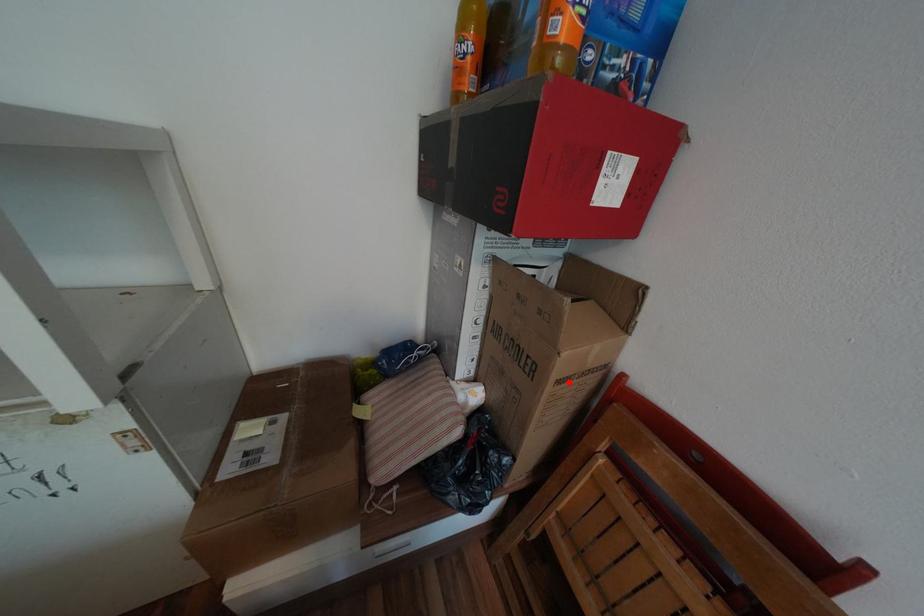
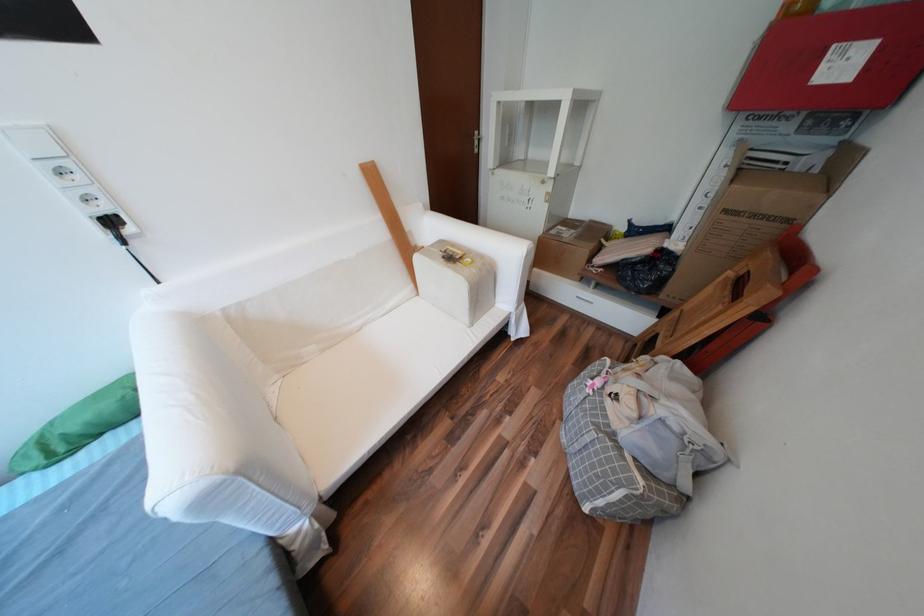
Question: I am providing you with two images of the same scene from different viewpoints. A red point is marked on the first image. At the location where the point appears in image 1, is it still visible in image 2?

Choices:
 (A) Yes
 (B) No

Answer: (A)